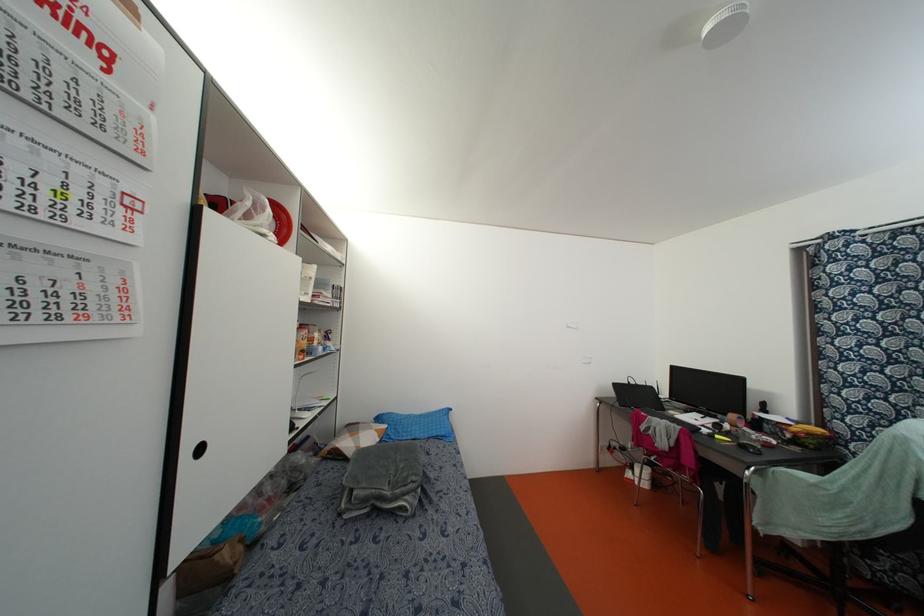
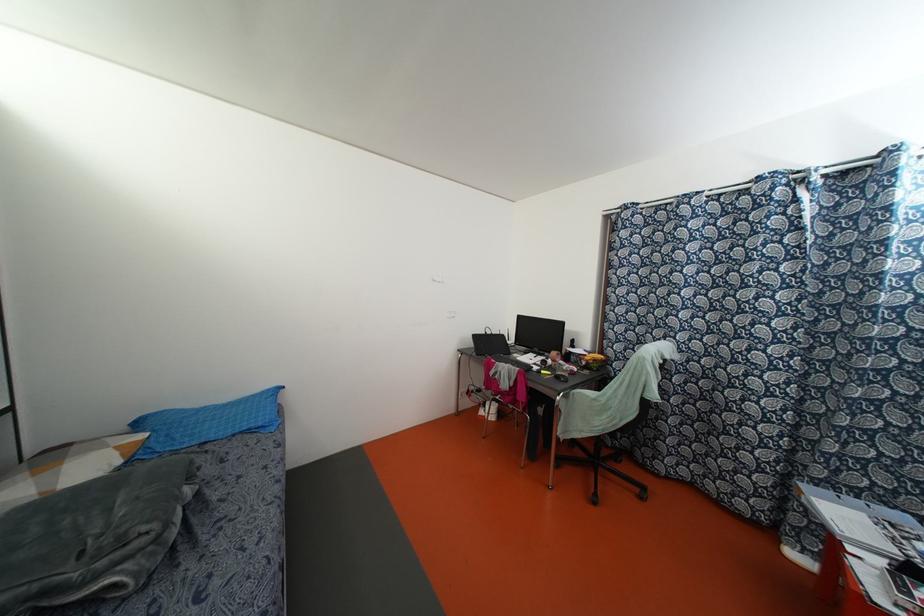
Find the pixel in the second image that matches point (378, 439) in the first image.

(118, 461)